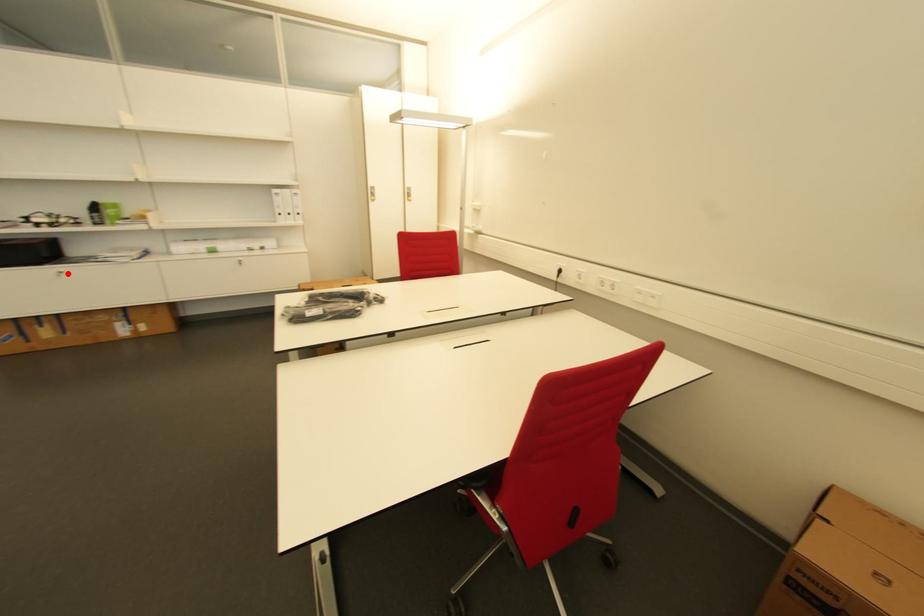
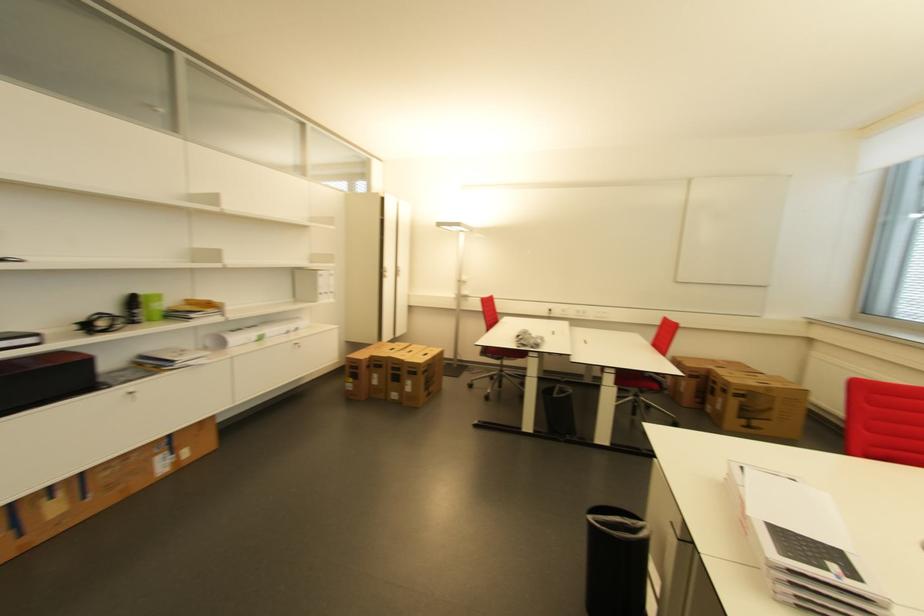
Question: I am providing you with two images of the same scene from different viewpoints. In image1, a red point is highlighted. Considering the same 3D point in image2, which of the following is correct?

Choices:
 (A) It is closer
 (B) It is farther

Answer: (A)